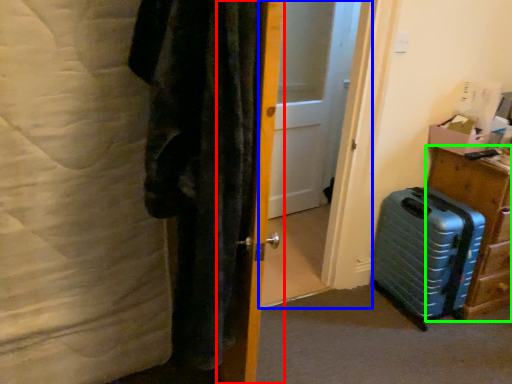
Question: Which is farther away from door (highlighted by a red box)? screen door (highlighted by a blue box) or furniture (highlighted by a green box)?

Choices:
 (A) screen door
 (B) furniture

Answer: (A)